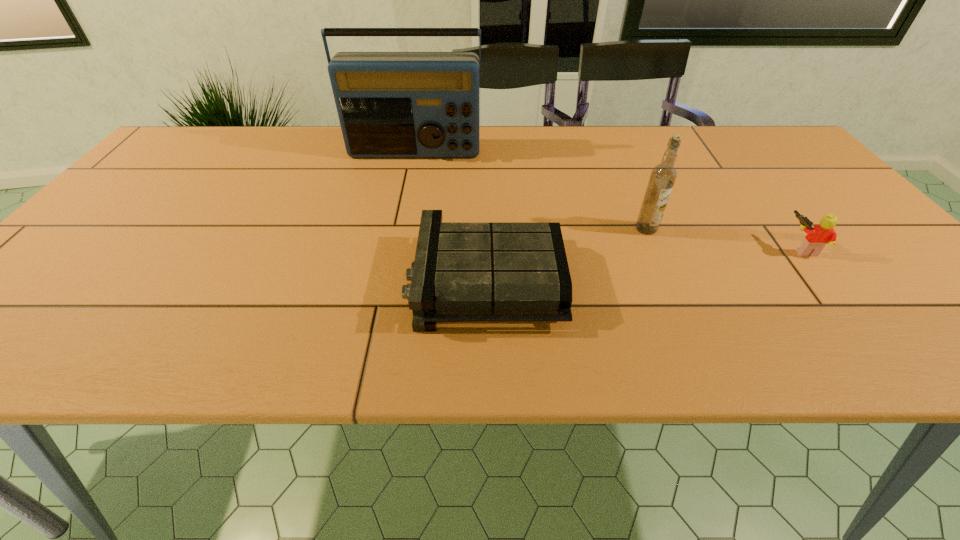
You are a GUI agent. You are given a task and a screenshot of the screen. Output one action in this format:
    pyautogui.click(x=<x>, y=<y>)
    Task: Click on the free space between the tallest object and the Lego
    The height and width of the screenshot is (540, 960).
    Given the screenshot: What is the action you would take?
    pyautogui.click(x=608, y=201)

This screenshot has height=540, width=960. Find the location of `vacant region between the taller radio receiver and the shortest object`. vacant region between the taller radio receiver and the shortest object is located at coordinates (450, 217).

Where is `free space between the third object from left to right and the second shortest object`? The height and width of the screenshot is (540, 960). free space between the third object from left to right and the second shortest object is located at coordinates (724, 239).

In order to click on object that is the third closest to the second shortest object in this screenshot , I will do 390,104.

Identify which object is the closest to the tallest object. Please provide its 2D coordinates. Your answer should be formatted as a tuple, i.e. [(x, y)], where the tuple contains the x and y coordinates of a point satisfying the conditions above.

[(463, 272)]

Locate an element on the screen. vacant region that satisfies the following two spatial constraints: 1. on the label of the vodka; 2. on the front panel of the nearer radio receiver is located at coordinates (668, 281).

Locate an element on the screen. The image size is (960, 540). vacant space that satisfies the following two spatial constraints: 1. on the label of the vodka; 2. on the front panel of the shorter radio receiver is located at coordinates (668, 281).